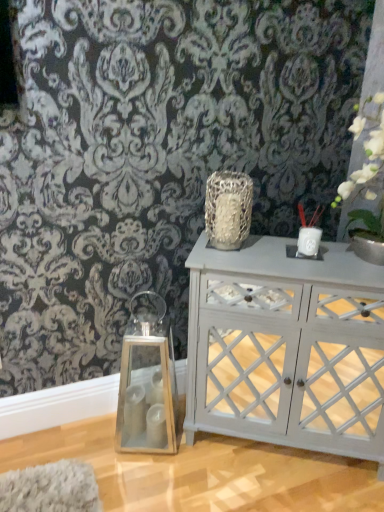
Question: Considering the positions of white matte vase at upper right and white painted wood cabinet at center in the image, is white matte vase at upper right wider or thinner than white painted wood cabinet at center?

Choices:
 (A) thin
 (B) wide

Answer: (B)

Question: From the image's perspective, relative to white painted wood cabinet at center, is white matte vase at upper right above or below?

Choices:
 (A) above
 (B) below

Answer: (A)

Question: Which is nearer to the white ceramic vase at upper right, arranged as the 3th candle holder when ordered from the bottom?

Choices:
 (A) white matte vase at upper right
 (B) white painted wood cabinet at center
 (C) white ceramic candle holder at upper right, positioned as the 2th candle holder in right-to-left order
 (D) textured silver vase at center
 (E) clear glass lantern at left, which is counted as the first candle holder, starting from the bottom

Answer: (C)

Question: Estimate the real-world distances between objects in this image. Which object is closer to the white painted wood cabinet at center?

Choices:
 (A) clear glass lantern at left, the 1th candle holder from the left
 (B) white ceramic candle holder at upper right, positioned as the 2th candle holder in right-to-left order
 (C) white matte vase at upper right
 (D) white ceramic vase at upper right, positioned as the first candle holder in right-to-left order
 (E) textured silver vase at center

Answer: (A)